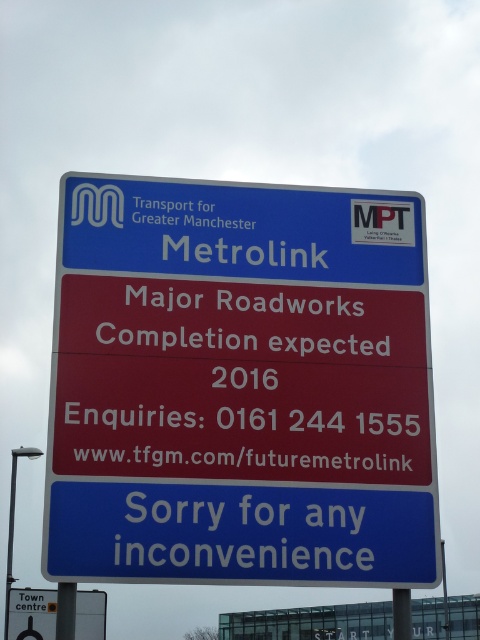
Is blue plastic signboard at upper center smaller than yellow plastic sign at lower left?

Yes.

Which is in front, point (129, 449) or point (54, 634)?

Positioned in front is point (129, 449).

Does point (392, 381) come closer to viewer compared to point (51, 612)?

Yes, it is in front of point (51, 612).

Locate an element on the screen. Image resolution: width=480 pixels, height=640 pixels. blue plastic signboard at upper center is located at coordinates (240, 387).